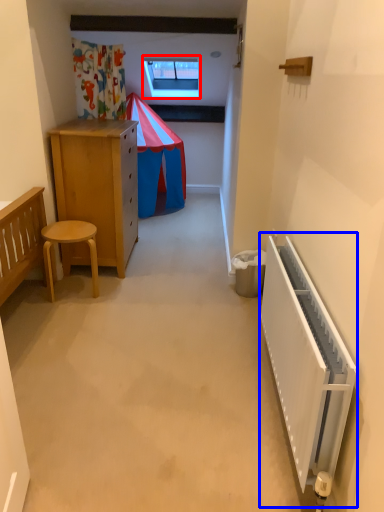
Question: Among these objects, which one is farthest to the camera, window (highlighted by a red box) or radiator (highlighted by a blue box)?

Choices:
 (A) window
 (B) radiator

Answer: (A)